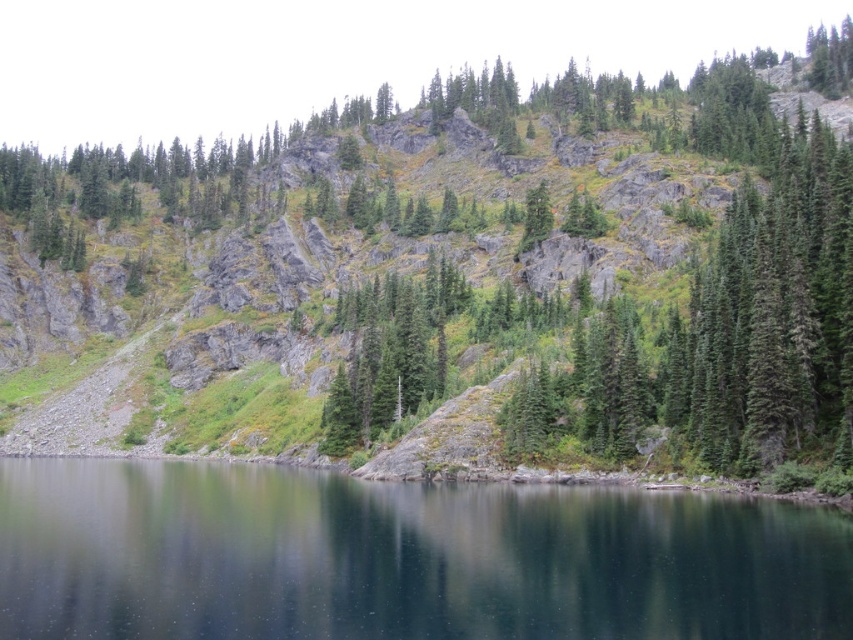
Question: Can you confirm if green grassy hillside at center is positioned to the right of dark blue water at center?

Choices:
 (A) no
 (B) yes

Answer: (B)

Question: Which object is closer to the camera taking this photo?

Choices:
 (A) dark blue water at center
 (B) green grassy hillside at center

Answer: (A)

Question: Can you confirm if green grassy hillside at center is positioned to the left of dark blue water at center?

Choices:
 (A) yes
 (B) no

Answer: (B)

Question: Does green grassy hillside at center come behind dark blue water at center?

Choices:
 (A) yes
 (B) no

Answer: (A)